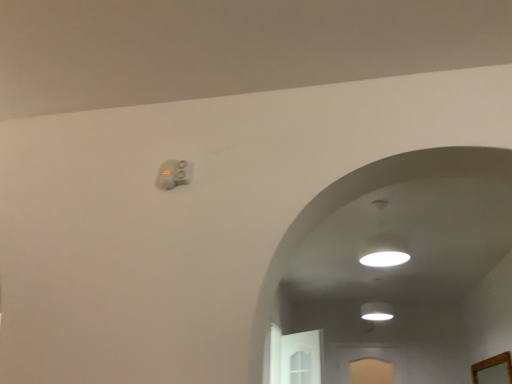
Question: Visually, is wooden mirror at lower right positioned to the left or to the right of white glossy lampshade at upper center?

Choices:
 (A) right
 (B) left

Answer: (A)

Question: Relative to white glossy lampshade at upper center, is wooden mirror at lower right in front or behind?

Choices:
 (A) behind
 (B) front

Answer: (A)

Question: In terms of width, does wooden mirror at lower right look wider or thinner when compared to white glossy lampshade at upper center?

Choices:
 (A) thin
 (B) wide

Answer: (A)

Question: From the image's perspective, is white glossy lampshade at upper center above or below wooden mirror at lower right?

Choices:
 (A) above
 (B) below

Answer: (A)

Question: Considering their positions, is white glossy lampshade at upper center located in front of or behind wooden mirror at lower right?

Choices:
 (A) behind
 (B) front

Answer: (B)

Question: Is white glossy lampshade at upper center to the left or to the right of wooden mirror at lower right in the image?

Choices:
 (A) right
 (B) left

Answer: (B)

Question: Is white glossy lampshade at upper center wider or thinner than wooden mirror at lower right?

Choices:
 (A) wide
 (B) thin

Answer: (A)